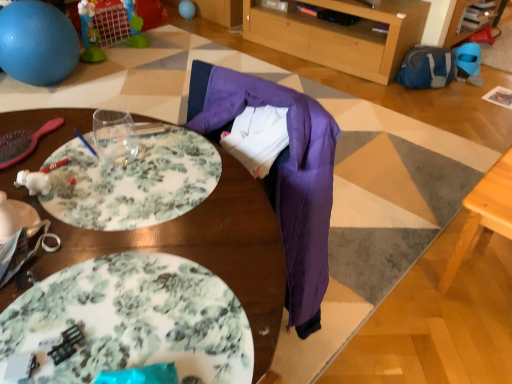
You are a GUI agent. You are given a task and a screenshot of the screen. Output one action in this format:
    pyautogui.click(x=<x>, y=<y>)
    Task: Click on the free point above floral ceramic plate at lower left, which ranks as the 2th plate in left-to-right order (from a real-world perspective)
    The height and width of the screenshot is (384, 512).
    Given the screenshot: What is the action you would take?
    click(x=120, y=319)